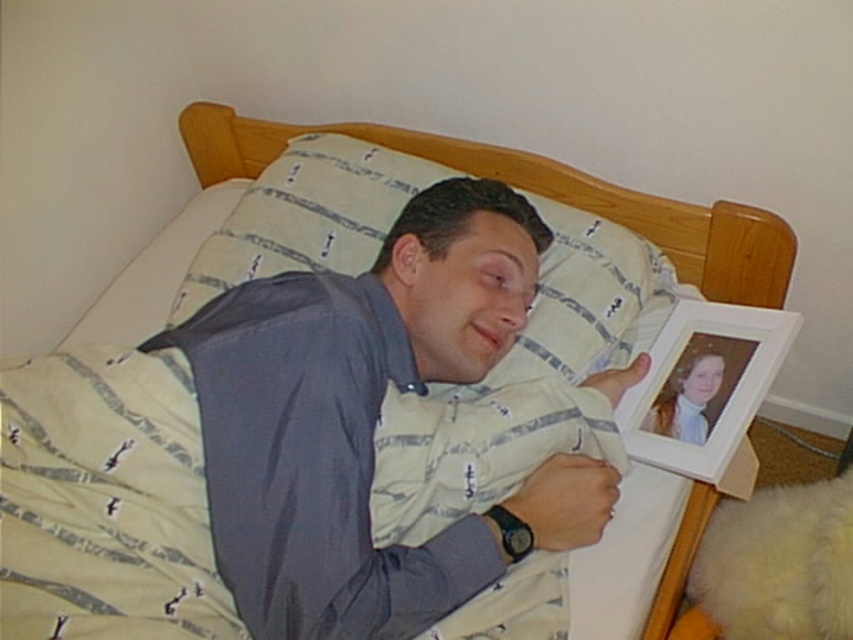
Question: Estimate the real-world distances between objects in this image. Which object is farther from the white matte picture frame at upper right?

Choices:
 (A) white striped pillow at upper center
 (B) white fluffy teddy at lower right

Answer: (A)

Question: Considering the relative positions of white fluffy teddy at lower right and white matte picture frame at upper right in the image provided, where is white fluffy teddy at lower right located with respect to white matte picture frame at upper right?

Choices:
 (A) above
 (B) below

Answer: (B)

Question: Is the position of white fluffy teddy at lower right less distant than that of white matte picture frame at upper right?

Choices:
 (A) no
 (B) yes

Answer: (B)

Question: Can you confirm if white striped pillow at upper center is positioned above white fluffy teddy at lower right?

Choices:
 (A) no
 (B) yes

Answer: (B)

Question: Considering the real-world distances, which object is farthest from the white fluffy teddy at lower right?

Choices:
 (A) white striped pillow at upper center
 (B) white matte picture frame at upper right

Answer: (A)

Question: Which is nearer to the white matte picture frame at upper right?

Choices:
 (A) white striped pillow at upper center
 (B) white fluffy teddy at lower right

Answer: (B)